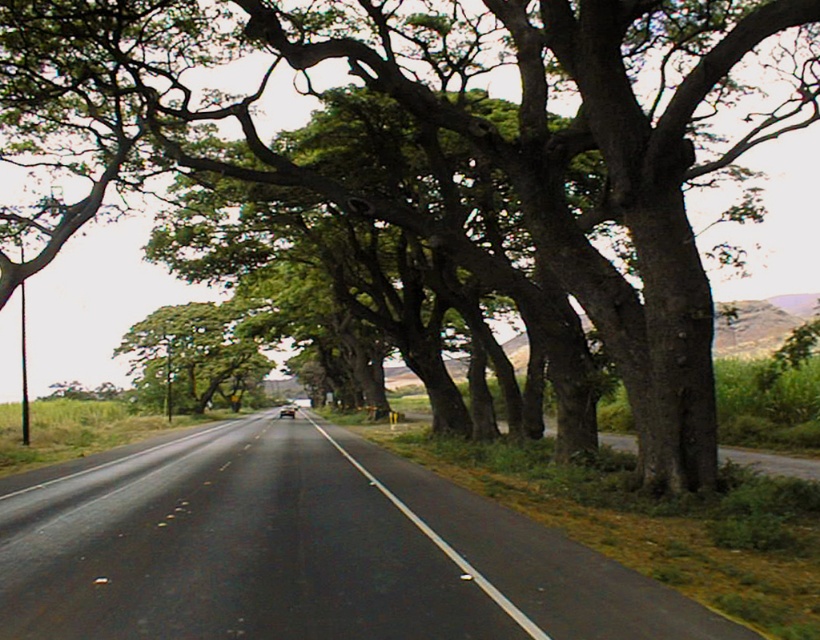
You are standing at the edge of the road and want to reach a specific point marked at coordinates point (263, 470). If your walking speed is 1.5 meters per second, how many seconds will it take you to reach that point?

The distance of point (263, 470) from viewer is 18.01 meters. At a walking speed of 1.5 meters per second, it will take approximately 12 seconds to reach the point.

You are driving a car that is 5 meters long. You want to park your car between the green leafy tree at center and the black asphalt road at center. Is there enough space between them to park your car?

The green leafy tree at center and the black asphalt road at center are 28.58 meters apart from each other, so yes, there is enough space to park a car that is 5 meters long between them.

You are standing at the point with coordinates (x=304, y=552) in the image. What object are you standing on?

You are standing on the black asphalt highway at center, which is located at point (x=304, y=552).